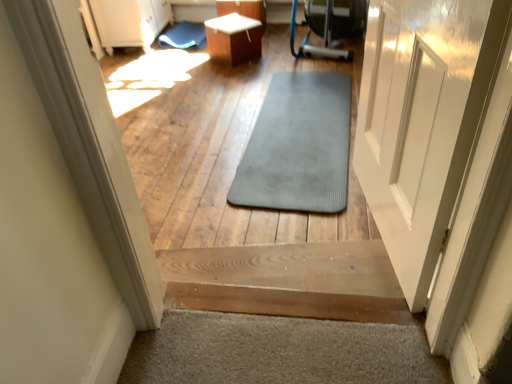
This screenshot has width=512, height=384. What are the coordinates of `free location above wooden stairs at center (from a real-world perspective)` in the screenshot? It's located at (297, 264).